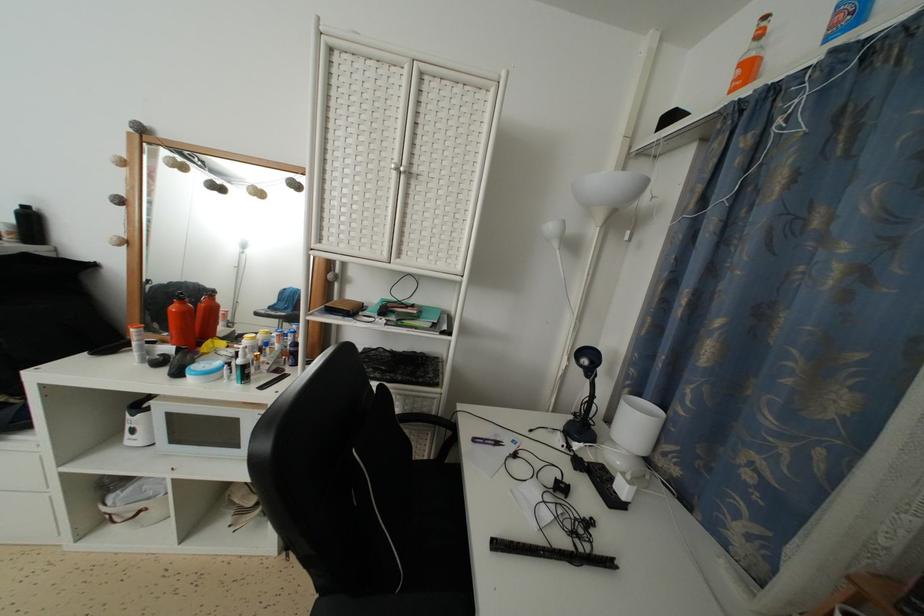
Describe the element at coordinates (845, 18) in the screenshot. I see `a blue food package` at that location.